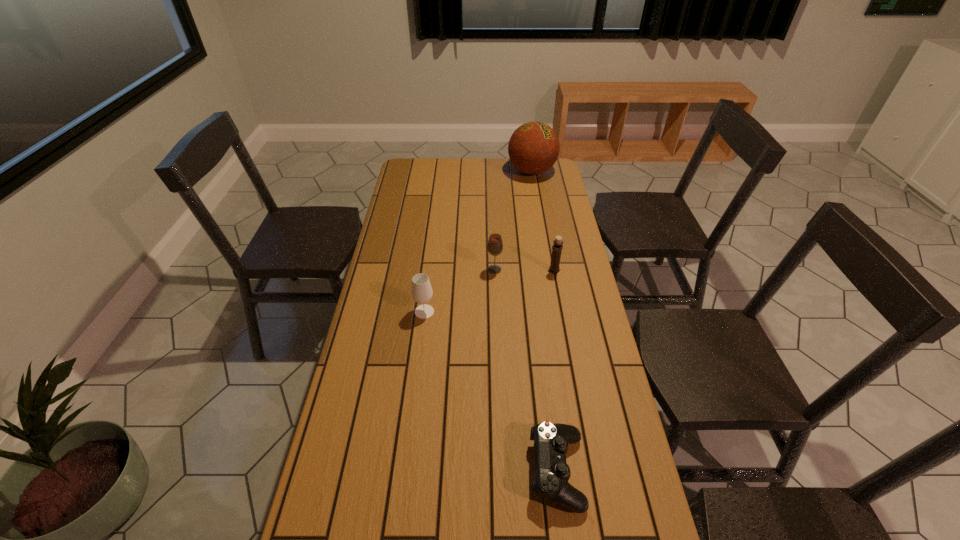
Find the location of a particular element. The height and width of the screenshot is (540, 960). empty space that is in between the nearest object and the left glass is located at coordinates (491, 392).

Image resolution: width=960 pixels, height=540 pixels. I want to click on unoccupied area between the candle holder and the second nearest object, so click(x=490, y=291).

Image resolution: width=960 pixels, height=540 pixels. Identify the location of vacant area that lies between the leftmost object and the tallest object. (478, 241).

Select which object appears as the closest to the shortest object. Please provide its 2D coordinates. Your answer should be formatted as a tuple, i.e. [(x, y)], where the tuple contains the x and y coordinates of a point satisfying the conditions above.

[(421, 292)]

At what (x,y) coordinates should I click in order to perform the action: click on the third closest object relative to the fourth object from right to left. Please return your answer as a coordinate pair (x, y). Image resolution: width=960 pixels, height=540 pixels. Looking at the image, I should click on (533, 148).

Where is `free spot that satisfies the following two spatial constraints: 1. on the back side of the farthest object; 2. on the left side of the farther glass`? The width and height of the screenshot is (960, 540). free spot that satisfies the following two spatial constraints: 1. on the back side of the farthest object; 2. on the left side of the farther glass is located at coordinates 491,171.

This screenshot has width=960, height=540. Identify the location of free location that satisfies the following two spatial constraints: 1. on the front side of the fourth object from right to left; 2. on the left side of the control. (502, 471).

This screenshot has width=960, height=540. Find the location of `free region that satisfies the following two spatial constraints: 1. on the back side of the second nearest object; 2. on the left side of the farther glass`. free region that satisfies the following two spatial constraints: 1. on the back side of the second nearest object; 2. on the left side of the farther glass is located at coordinates (429, 270).